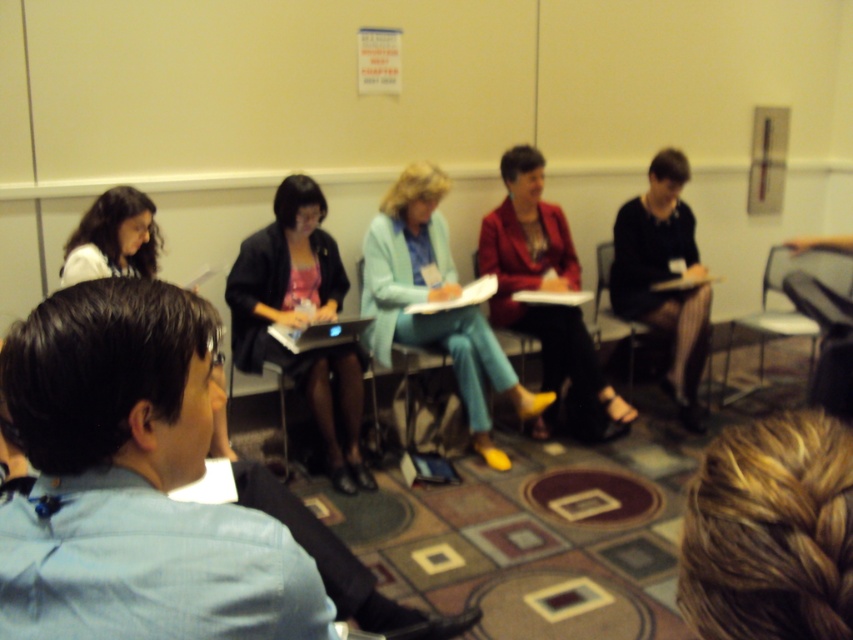
Question: Can you confirm if light blue fabric jacket at center is smaller than black fabric dress at right?

Choices:
 (A) no
 (B) yes

Answer: (A)

Question: Can you confirm if black fabric dress at right is positioned above metallic silver chair at center?

Choices:
 (A) no
 (B) yes

Answer: (B)

Question: Which object is the farthest from the matte black jacket at center?

Choices:
 (A) blonde braided hair at center
 (B) metallic silver chair at right
 (C) blue shirt at center
 (D) light blue fabric jacket at center

Answer: (A)

Question: Which object is closer to the camera taking this photo?

Choices:
 (A) blonde braided hair at center
 (B) metallic silver chair at center
 (C) matte white shirt at left

Answer: (A)

Question: Is metallic silver chair at right bigger than metallic silver chair at center?

Choices:
 (A) no
 (B) yes

Answer: (B)

Question: Which point is farther to the camera?

Choices:
 (A) matte red blazer at center
 (B) light blue fabric jacket at center

Answer: (A)